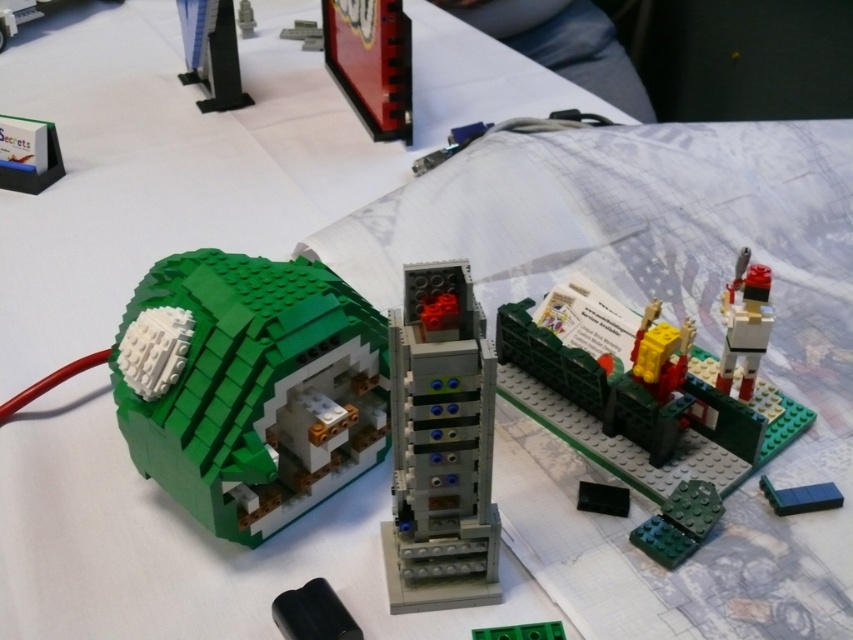
Question: Which object is the farthest from the black plastic toy at upper left?

Choices:
 (A) black rubber block at lower left
 (B) brushed metal bench at upper left
 (C) gray plastic tower at center

Answer: (A)

Question: Which object is the closest to the metallic silver gear at upper center?

Choices:
 (A) black plastic toy at upper left
 (B) black rubber block at lower left
 (C) brick red plastic sign at upper center
 (D) brushed metal bench at upper left

Answer: (A)

Question: In this image, where is brick-like green platform at center located relative to matte gray brick at upper center?

Choices:
 (A) left
 (B) right

Answer: (B)

Question: Can you confirm if black rubber block at lower left is bigger than matte gray brick at upper center?

Choices:
 (A) yes
 (B) no

Answer: (B)

Question: Among these objects, which one is nearest to the camera?

Choices:
 (A) gray plastic tower at center
 (B) green plastic plate at lower right
 (C) metallic silver gear at upper center
 (D) black rubber block at lower left

Answer: (A)

Question: Can you confirm if green matte lego house at left is thinner than green matte brick at lower right?

Choices:
 (A) yes
 (B) no

Answer: (B)